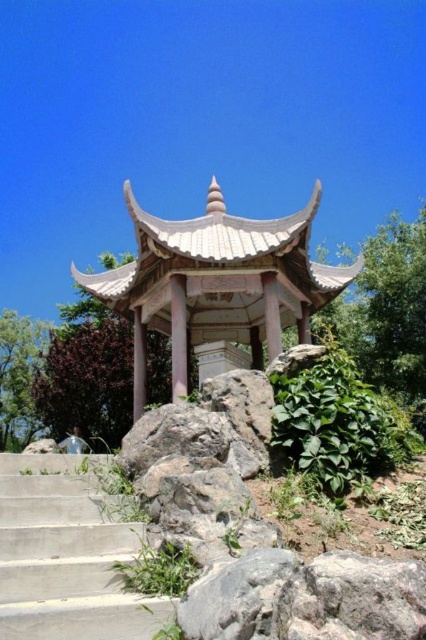
Who is higher up, concrete stairs at lower left or green leafy plant at center right?

green leafy plant at center right

Between concrete stairs at lower left and green leafy plant at center right, which one has more height?

Standing taller between the two is green leafy plant at center right.

Describe the element at coordinates (66, 556) in the screenshot. This screenshot has height=640, width=426. I see `concrete stairs at lower left` at that location.

Where is `concrete stairs at lower left`? This screenshot has width=426, height=640. concrete stairs at lower left is located at coordinates (66, 556).

Is white stone gazebo at center to the left of concrete stairs at lower left from the viewer's perspective?

Incorrect, white stone gazebo at center is not on the left side of concrete stairs at lower left.

Find the location of a particular element. The image size is (426, 640). white stone gazebo at center is located at coordinates (216, 282).

Is the position of white stone gazebo at center less distant than that of green leafy plant at center right?

No, it is not.

Does white stone gazebo at center appear under green leafy plant at center right?

No.

Locate an element on the screen. white stone gazebo at center is located at coordinates (216, 282).